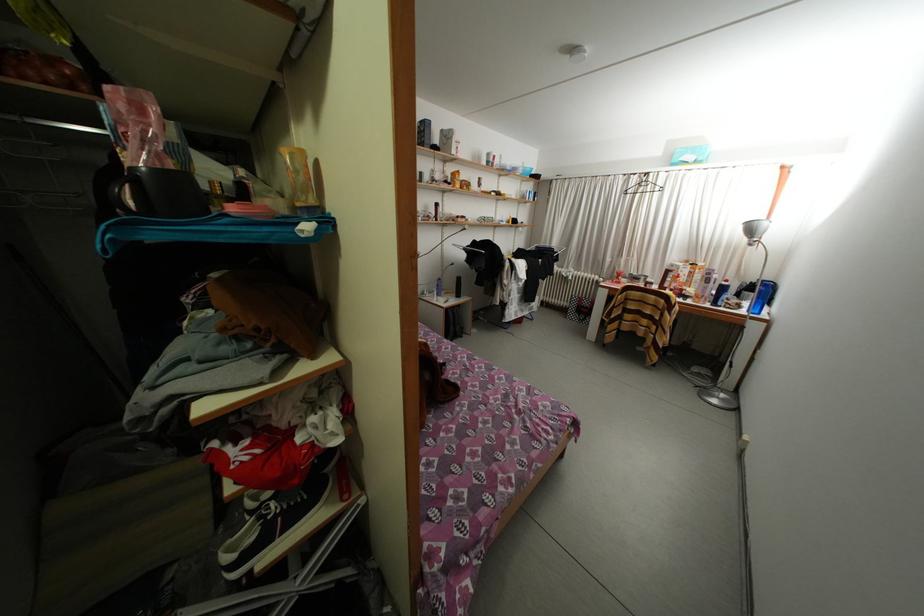
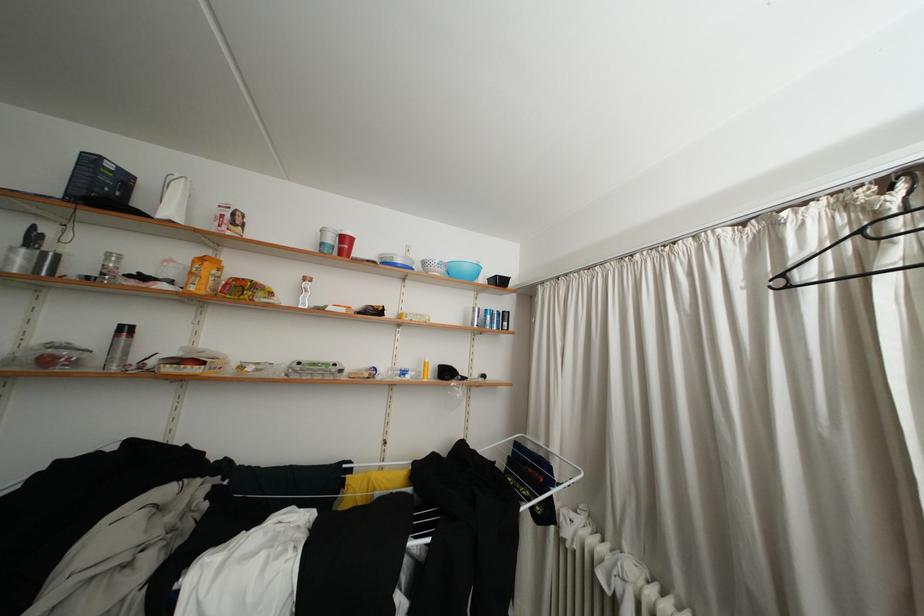
Find the pixel in the second image that matches the point at 555,251 in the first image.

(550, 448)